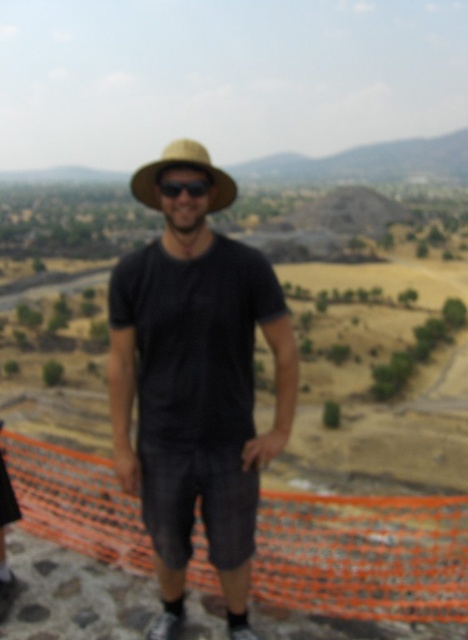
Question: Among these objects, which one is farthest from the camera?

Choices:
 (A) straw hat at center
 (B) black matte sunglasses at center
 (C) matte black shirt at center

Answer: (B)

Question: Which of the following is the closest to the observer?

Choices:
 (A) (170, 316)
 (B) (200, 195)

Answer: (A)

Question: Can you confirm if straw hat at center is thinner than black matte sunglasses at center?

Choices:
 (A) yes
 (B) no

Answer: (B)

Question: Is matte black shirt at center bigger than black matte sunglasses at center?

Choices:
 (A) yes
 (B) no

Answer: (A)

Question: Which of these objects is positioned closest to the matte black shirt at center?

Choices:
 (A) straw hat at center
 (B) black matte sunglasses at center

Answer: (B)

Question: Where is matte black shirt at center located in relation to straw hat at center in the image?

Choices:
 (A) right
 (B) left

Answer: (A)